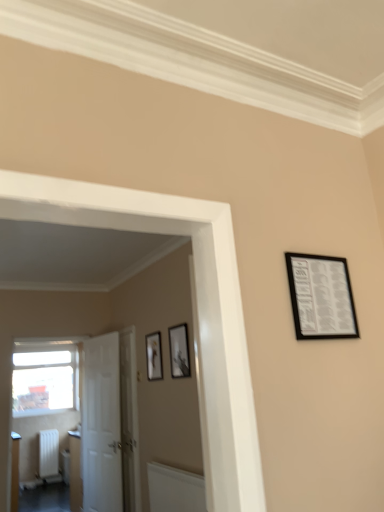
Image resolution: width=384 pixels, height=512 pixels. What do you see at coordinates (49, 456) in the screenshot?
I see `white matte radiator at lower left` at bounding box center [49, 456].

In order to face white matte radiator at lower left, should I rotate leftwards or rightwards?

To face it directly, rotate left by 18.767 degrees.

What do you see at coordinates (101, 425) in the screenshot?
I see `white matte door at left, marked as the first door in a left-to-right arrangement` at bounding box center [101, 425].

How much space does matte black picture frame at center, which ranks as the 1th picture frame in back-to-front order, occupy horizontally?

It is 1.08 inches.

What do you see at coordinates (129, 421) in the screenshot? I see `white glossy door at center, which is the 1th door in right-to-left order` at bounding box center [129, 421].

Identify the location of matte black picture frame at center, the 2th picture frame when ordered from back to front. (179, 351).

Where is `furniture on the left side of matte black picture frame at center, the 2th picture frame when ordered from back to front`? This screenshot has height=512, width=384. furniture on the left side of matte black picture frame at center, the 2th picture frame when ordered from back to front is located at coordinates (15, 470).

Considering the positions of points (15, 455) and (169, 343), is point (15, 455) closer to camera compared to point (169, 343)?

No.

From a real-world perspective, who is located lower, transparent glass window at left or matte black picture frame at center, which ranks as the 1th picture frame in back-to-front order?

From a 3D spatial view, transparent glass window at left is below.

Where is `window that appears below the matte black picture frame at center, the 1th picture frame in the bottom-to-top sequence (from a real-world perspective)`? This screenshot has width=384, height=512. window that appears below the matte black picture frame at center, the 1th picture frame in the bottom-to-top sequence (from a real-world perspective) is located at coordinates (45, 381).

Does point (33, 362) lie behind point (159, 345)?

Yes, it is.

Is matte white radiator at lower left in front of or behind black matte picture frame at upper right, which is counted as the first picture frame, starting from the right, in the image?

Clearly, matte white radiator at lower left is behind black matte picture frame at upper right, which is counted as the first picture frame, starting from the right.

This screenshot has width=384, height=512. Identify the location of picture frame that is the 3rd one when counting forward from the matte white radiator at lower left. (321, 297).

Would you say matte white radiator at lower left is a long distance from black matte picture frame at upper right, which is the first picture frame from front to back?

matte white radiator at lower left is far away from black matte picture frame at upper right, which is the first picture frame from front to back.

Does matte black picture frame at center, which is the second picture frame from front to back, have a greater width compared to matte black picture frame at center, arranged as the 1th picture frame when viewed from the left?

Yes, matte black picture frame at center, which is the second picture frame from front to back, is wider than matte black picture frame at center, arranged as the 1th picture frame when viewed from the left.

Considering the points (171, 327) and (148, 375), which point is behind, point (171, 327) or point (148, 375)?

The point (148, 375) is farther from the camera.

Considering their positions, is matte black picture frame at center, marked as the second picture frame in a left-to-right arrangement, located in front of or behind matte black picture frame at center, which is counted as the third picture frame, starting from the right?

In the image, matte black picture frame at center, marked as the second picture frame in a left-to-right arrangement, appears in front of matte black picture frame at center, which is counted as the third picture frame, starting from the right.

Can you confirm if matte black picture frame at center, the 2th picture frame when ordered from back to front, is positioned to the right of matte black picture frame at center, which ranks as the 1th picture frame in back-to-front order?

Yes.

Is white glossy door at center, arranged as the second door when viewed from the left, thinner than matte white radiator at lower left?

Incorrect, the width of white glossy door at center, arranged as the second door when viewed from the left, is not less than that of matte white radiator at lower left.

Is there a large distance between white glossy door at center, which is the 1th door in right-to-left order, and matte white radiator at lower left?

white glossy door at center, which is the 1th door in right-to-left order, is positioned a significant distance from matte white radiator at lower left.

Is point (130, 367) positioned after point (16, 443)?

No.

Is point (45, 436) positioned before point (18, 436)?

That is False.

Consider the image. Is white matte radiator at lower left oriented towards matte white radiator at lower left?

No, white matte radiator at lower left is not turned towards matte white radiator at lower left.

Does white matte radiator at lower left have a greater height compared to matte white radiator at lower left?

No.

From the image's perspective, which one is positioned higher, white matte radiator at lower left or matte white radiator at lower left?

matte white radiator at lower left appears higher in the image.

Consider the image. Which object is positioned more to the right, transparent glass window at left or matte black picture frame at center, which appears as the 2th picture frame when viewed from the right?

matte black picture frame at center, which appears as the 2th picture frame when viewed from the right.

Which is in front, point (16, 383) or point (178, 355)?

The point (178, 355) is more forward.

I want to click on window lying behind the matte black picture frame at center, the 2th picture frame when ordered from back to front, so (x=45, y=381).

How different are the orientations of transparent glass window at left and matte black picture frame at center, the 2th picture frame when ordered from back to front, in degrees?

There is a 89.5-degree angle between the facing directions of transparent glass window at left and matte black picture frame at center, the 2th picture frame when ordered from back to front.

Starting from the matte white radiator at lower left, which picture frame is the 2nd one in front? Please provide its 2D coordinates.

[(179, 351)]

Image resolution: width=384 pixels, height=512 pixels. I want to click on window located below the matte black picture frame at center, which ranks as the 1th picture frame in back-to-front order (from the image's perspective), so click(x=45, y=381).

Considering their positions, is white matte door at left, marked as the first door in a left-to-right arrangement, positioned further to transparent glass window at left than black matte picture frame at upper right, which is the third picture frame in bottom-to-top order?

black matte picture frame at upper right, which is the third picture frame in bottom-to-top order, is further to transparent glass window at left.

Consider the image. From the image, which object appears to be farther from black matte picture frame at upper right, which is the first picture frame from front to back, transparent glass window at left or white glossy door at center, which is the 1th door in right-to-left order?

transparent glass window at left is positioned further to the anchor black matte picture frame at upper right, which is the first picture frame from front to back.

From the image, which object appears to be farther from matte black picture frame at center, the 2th picture frame in the bottom-to-top sequence, white matte radiator at lower left or matte white radiator at lower left?

white matte radiator at lower left is further to matte black picture frame at center, the 2th picture frame in the bottom-to-top sequence.

When comparing their distances from matte black picture frame at center, which appears as the 2th picture frame when viewed from the right, does matte black picture frame at center, which is counted as the third picture frame, starting from the right, or matte white radiator at lower left seem closer?

matte black picture frame at center, which is counted as the third picture frame, starting from the right, lies closer to matte black picture frame at center, which appears as the 2th picture frame when viewed from the right, than the other object.

Estimate the real-world distances between objects in this image. Which object is closer to matte black picture frame at center, the 2th picture frame when ordered from back to front, matte black picture frame at center, arranged as the 1th picture frame when viewed from the left, or white glossy door at center, which is the 1th door in right-to-left order?

The object closer to matte black picture frame at center, the 2th picture frame when ordered from back to front, is matte black picture frame at center, arranged as the 1th picture frame when viewed from the left.

From the image, which object appears to be nearer to transparent glass window at left, white matte door at left, the 2th door from the right, or white glossy door at center, which is the 1th door in right-to-left order?

Among the two, white matte door at left, the 2th door from the right, is located nearer to transparent glass window at left.

Which object lies further to the anchor point white glossy door at center, which is the 1th door in right-to-left order, white matte door at left, marked as the first door in a left-to-right arrangement, or matte black picture frame at center, which appears as the 2th picture frame when viewed from the right?

The object further to white glossy door at center, which is the 1th door in right-to-left order, is matte black picture frame at center, which appears as the 2th picture frame when viewed from the right.

Which object lies nearer to the anchor point transparent glass window at left, matte white radiator at lower left or black matte picture frame at upper right, placed as the 1th picture frame when sorted from top to bottom?

matte white radiator at lower left.

This screenshot has width=384, height=512. I want to click on door between matte black picture frame at center, which ranks as the 1th picture frame in back-to-front order, and white matte door at left, the 2th door from the right, vertically, so click(x=129, y=421).

I want to click on picture frame between matte white radiator at lower left and matte black picture frame at center, which is the second picture frame from front to back, from left to right, so click(x=154, y=356).

Where is `picture frame between matte black picture frame at center, marked as the second picture frame in a left-to-right arrangement, and white matte radiator at lower left, along the z-axis`? picture frame between matte black picture frame at center, marked as the second picture frame in a left-to-right arrangement, and white matte radiator at lower left, along the z-axis is located at coordinates [x=154, y=356].

This screenshot has width=384, height=512. What are the coordinates of `door between black matte picture frame at upper right, the 3th picture frame positioned from the back, and white glossy door at center, which is the 1th door in right-to-left order, from front to back` in the screenshot? It's located at (101, 425).